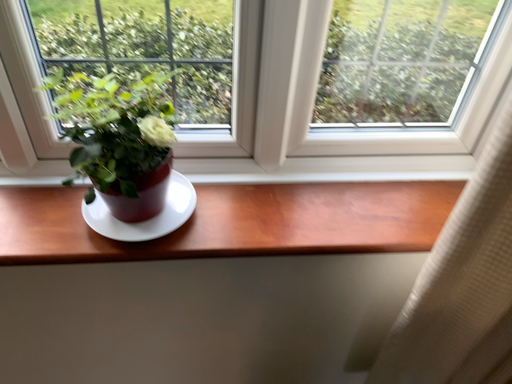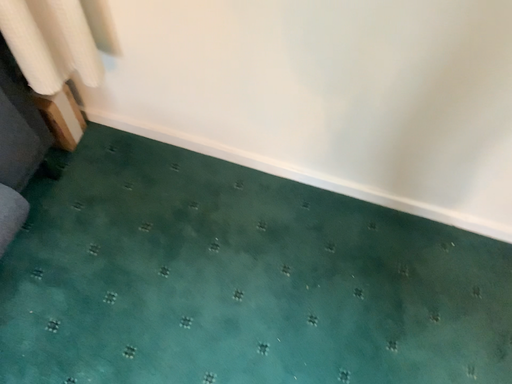
Question: Which way did the camera rotate in the video?

Choices:
 (A) rotated right
 (B) rotated left

Answer: (B)